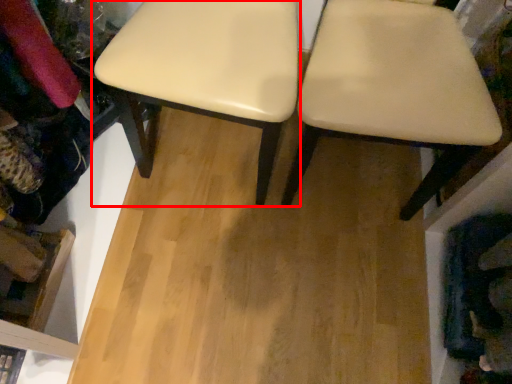
Question: From the image's perspective, where is stool (annotated by the red box) located relative to chair?

Choices:
 (A) below
 (B) above

Answer: (B)